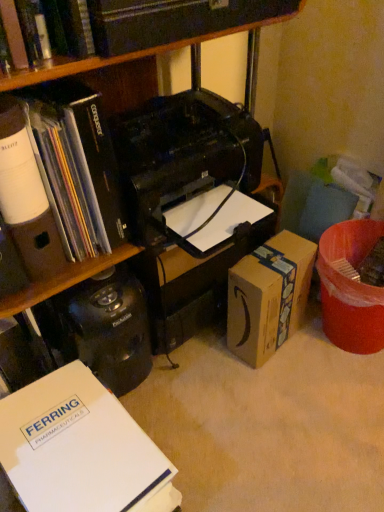
The image size is (384, 512). I want to click on vacant space that is in between white paper at lower left, the 1th book positioned from the bottom, and brown cardboard box at lower right, so click(x=207, y=416).